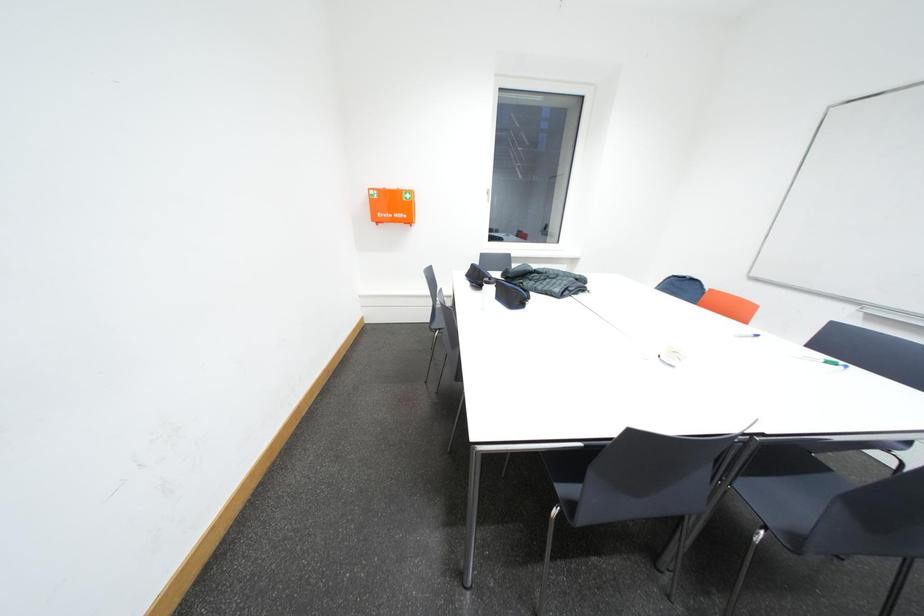
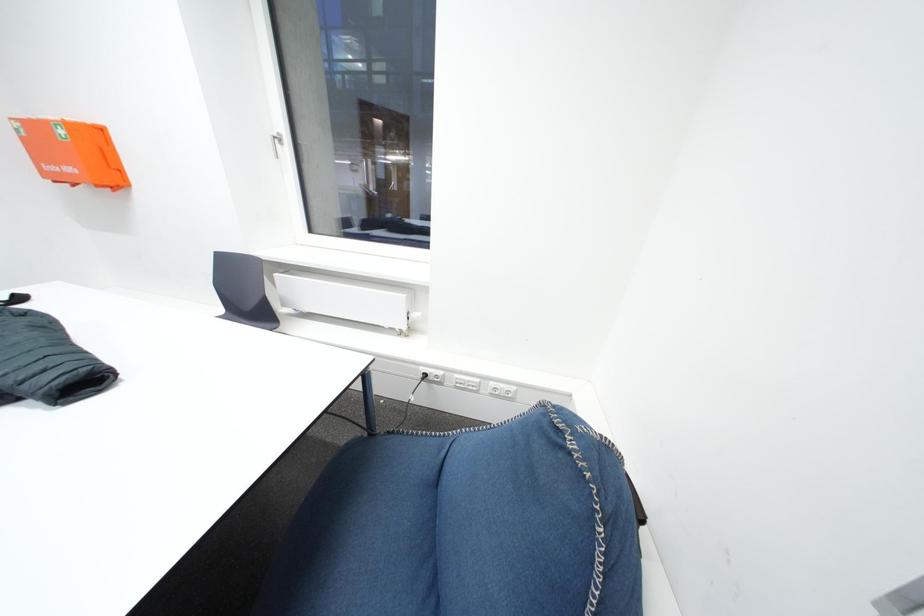
Which direction would the cameraman need to move to produce the second image?

The movement direction of the cameraman is right, forward.